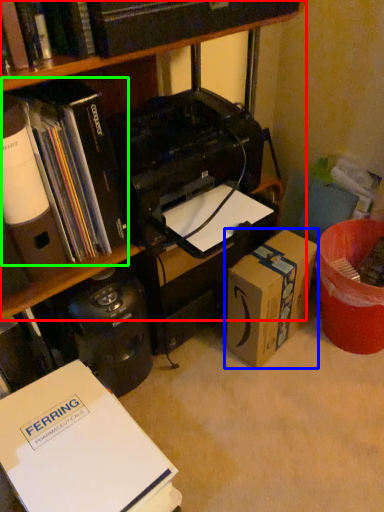
Question: Considering the real-world distances, which object is farthest from bookcase (highlighted by a red box)? box (highlighted by a blue box) or book (highlighted by a green box)?

Choices:
 (A) box
 (B) book

Answer: (A)